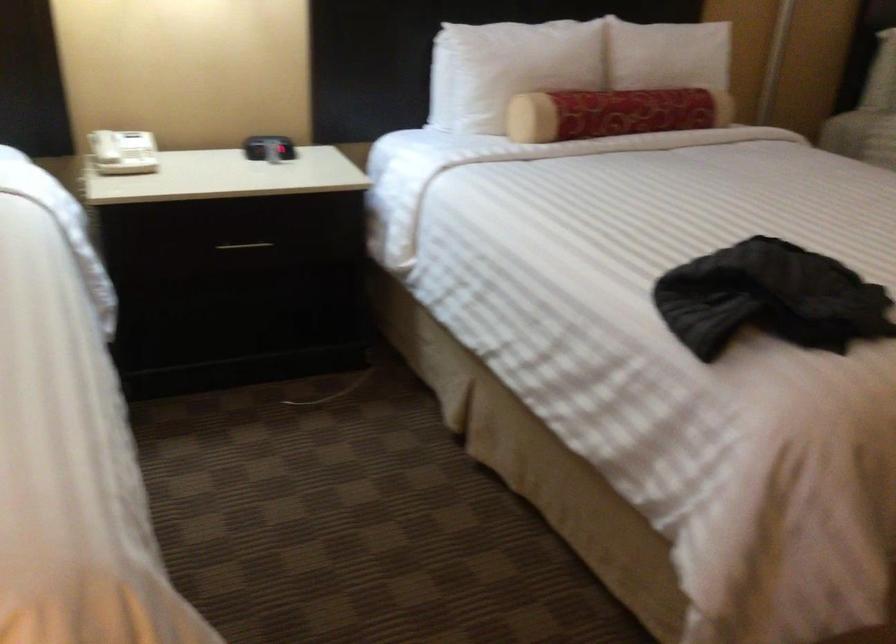
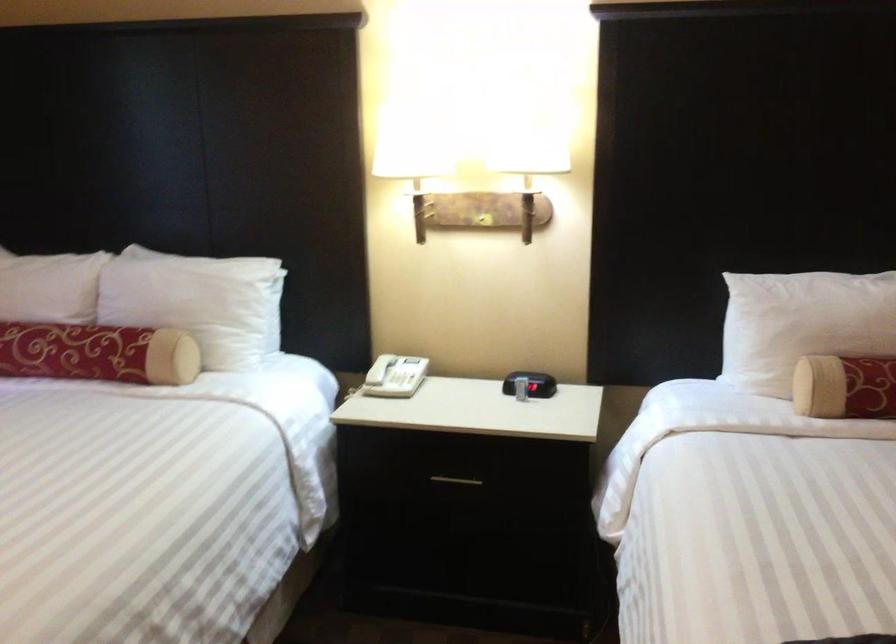
In the second image, find the point that corresponds to point (108, 151) in the first image.

(380, 368)